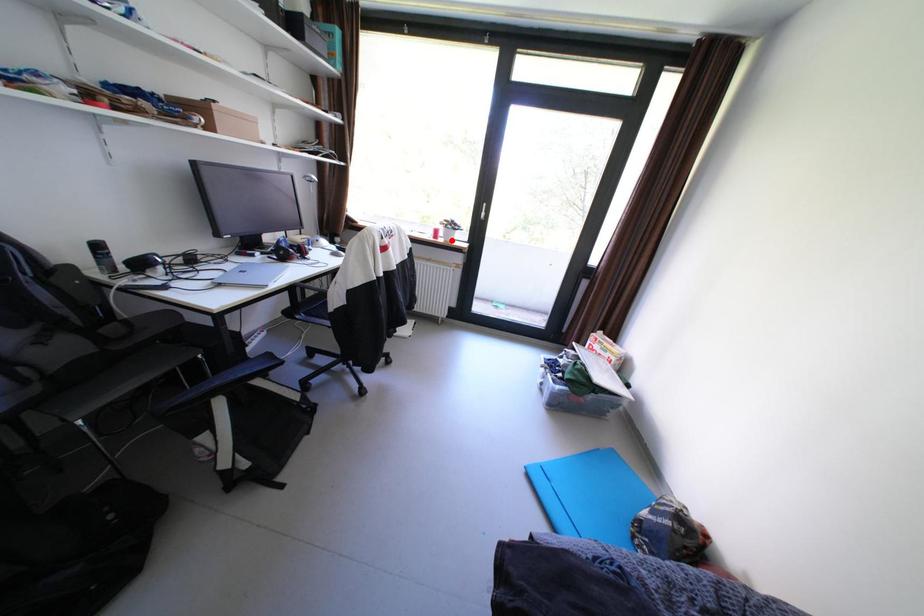
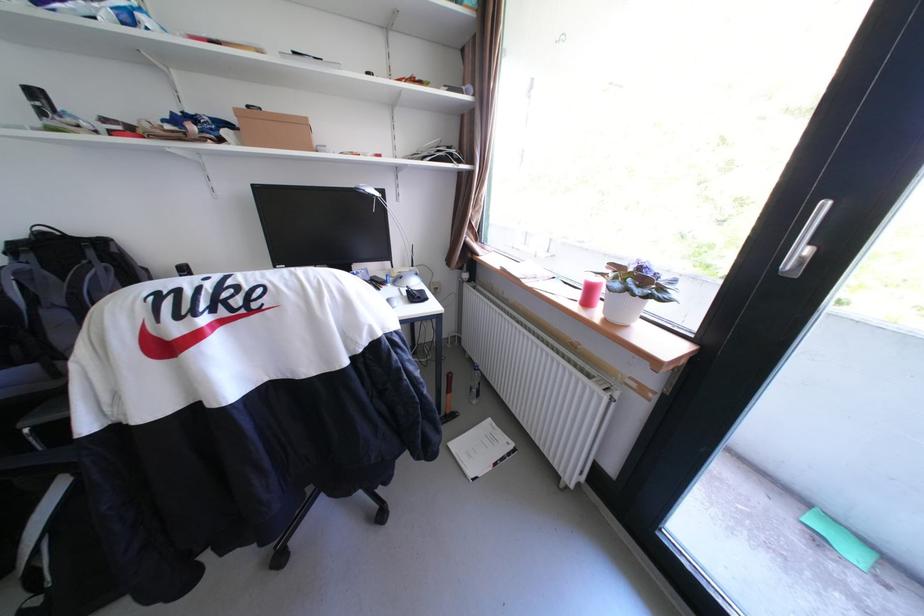
Locate, in the second image, the point that corresponds to the highlighted location in the first image.

(608, 313)